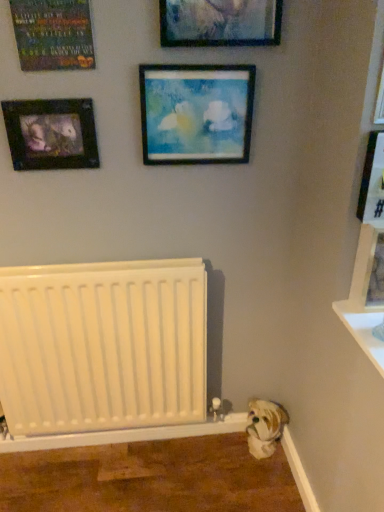
Question: Are wooden picture frame at right, acting as the 6th picture frame starting from the left, and wooden frame at center, the third picture frame positioned from the left, located far from each other?

Choices:
 (A) yes
 (B) no

Answer: (B)

Question: Could you tell me if wooden picture frame at right, marked as the 2th picture frame in a right-to-left arrangement, is turned towards wooden frame at center, marked as the fifth picture frame in a right-to-left arrangement?

Choices:
 (A) no
 (B) yes

Answer: (A)

Question: Considering the relative sizes of wooden picture frame at right, marked as the 2th picture frame in a right-to-left arrangement, and wooden frame at center, the third picture frame positioned from the left, in the image provided, is wooden picture frame at right, marked as the 2th picture frame in a right-to-left arrangement, bigger than wooden frame at center, the third picture frame positioned from the left,?

Choices:
 (A) yes
 (B) no

Answer: (A)

Question: Is wooden picture frame at right, marked as the 2th picture frame in a right-to-left arrangement, positioned before wooden frame at center, the third picture frame positioned from the left?

Choices:
 (A) yes
 (B) no

Answer: (A)

Question: Considering the relative positions of wooden picture frame at right, acting as the 6th picture frame starting from the left, and wooden frame at center, marked as the fifth picture frame in a right-to-left arrangement, in the image provided, is wooden picture frame at right, acting as the 6th picture frame starting from the left, behind wooden frame at center, marked as the fifth picture frame in a right-to-left arrangement,?

Choices:
 (A) yes
 (B) no

Answer: (B)

Question: From the image's perspective, is wooden frame at center, the third picture frame positioned from the left, positioned above or below white glossy shelf at lower right?

Choices:
 (A) above
 (B) below

Answer: (A)

Question: Choose the correct answer: Is wooden frame at center, marked as the fifth picture frame in a right-to-left arrangement, inside white glossy shelf at lower right or outside it?

Choices:
 (A) inside
 (B) outside

Answer: (B)

Question: Looking at the image, does wooden frame at center, marked as the fifth picture frame in a right-to-left arrangement, seem bigger or smaller compared to white glossy shelf at lower right?

Choices:
 (A) big
 (B) small

Answer: (B)

Question: Would you say wooden frame at center, marked as the fifth picture frame in a right-to-left arrangement, is to the left or to the right of white glossy shelf at lower right in the picture?

Choices:
 (A) left
 (B) right

Answer: (A)

Question: Is point (188, 39) positioned closer to the camera than point (364, 296)?

Choices:
 (A) closer
 (B) farther

Answer: (B)

Question: In the image, is matte glass picture frame at upper center, the 4th picture frame positioned from the right, positioned in front of or behind wooden picture frame at right, the seventh picture frame in the left-to-right sequence?

Choices:
 (A) front
 (B) behind

Answer: (A)

Question: In terms of width, does matte glass picture frame at upper center, the 4th picture frame positioned from the right, look wider or thinner when compared to wooden picture frame at right, the seventh picture frame in the left-to-right sequence?

Choices:
 (A) wide
 (B) thin

Answer: (B)

Question: Which is correct: matte glass picture frame at upper center, the 4th picture frame from the left, is inside wooden picture frame at right, the seventh picture frame in the left-to-right sequence, or outside of it?

Choices:
 (A) inside
 (B) outside

Answer: (B)

Question: Is point (9, 146) closer or farther from the camera than point (274, 27)?

Choices:
 (A) farther
 (B) closer

Answer: (A)

Question: Based on their sizes in the image, would you say matte black picture frame at upper left, which ranks as the 7th picture frame in right-to-left order, is bigger or smaller than matte glass picture frame at upper center, the 4th picture frame positioned from the right?

Choices:
 (A) small
 (B) big

Answer: (A)